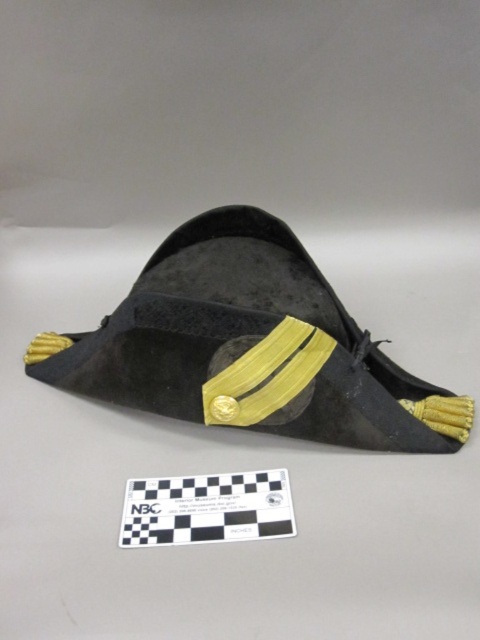
Which of these two, velvet black tricorn hat at center or black paper at center, stands taller?

Standing taller between the two is velvet black tricorn hat at center.

Who is lower down, velvet black tricorn hat at center or black paper at center?

black paper at center is lower down.

Is point (84, 385) closer to viewer compared to point (219, 490)?

That is False.

The width and height of the screenshot is (480, 640). In order to click on velvet black tricorn hat at center in this screenshot , I will do `click(249, 346)`.